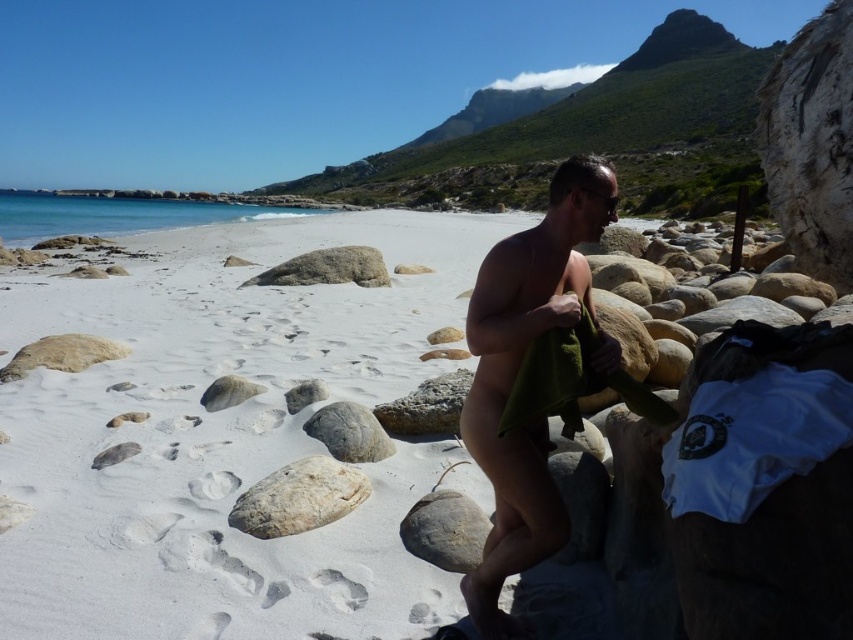
You are standing on the beach looking at the gray rough rock at lower center and the smooth gray rock at center. Which rock is nearer to you?

The gray rough rock at lower center is closer to the viewer than the smooth gray rock at center.

You are standing on the beach and want to place a small seashell on the tallest gray smooth rock. Which rock should you choose between the gray smooth rock at lower left and the gray smooth rock at center?

The gray smooth rock at lower left is taller than the gray smooth rock at center, so you should place the seashell on the gray smooth rock at lower left.